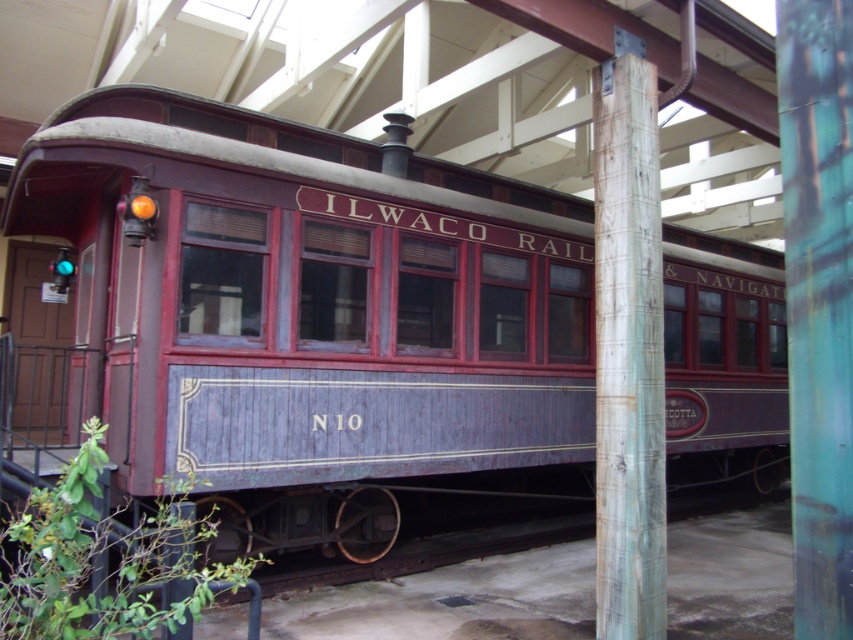
You are an architect designing a new exhibit space. The matte wood train car at center and the wooden post at center need to be placed side by side. Which object requires more width in the design plan?

The wooden post at center requires more width in the design plan because it is thicker than the matte wood train car at center.

You are standing in front of the ILWACO RAIL train car at the museum. You notice a point marked at coordinates (165,296) on the train car. If you want to reach that point with a 5 meter long ladder, will the ladder be long enough?

The distance of point (165,296) from viewer is 5.69 meters. Since the ladder is only 5 meters long, it is not long enough to reach the point.